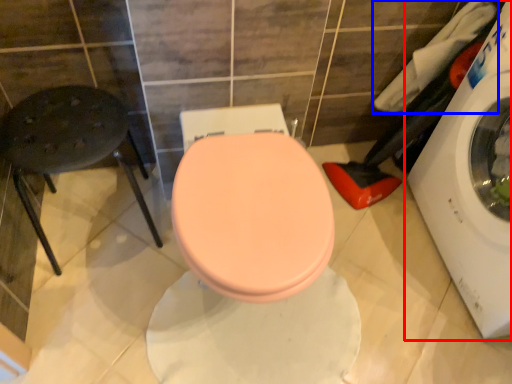
Question: Which of the following is the closest to the observer, washing machine (highlighted by a red box) or laundry (highlighted by a blue box)?

Choices:
 (A) washing machine
 (B) laundry

Answer: (A)